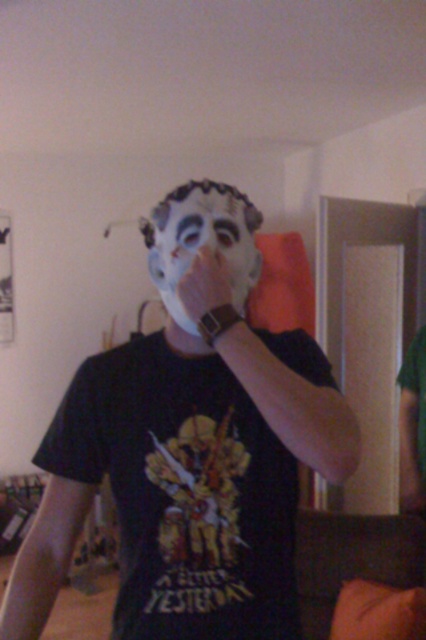
Consider the image. Does matte white mask at center have a greater height compared to white matte mask at center?

Yes.

Is matte white mask at center bigger than white matte mask at center?

Indeed, matte white mask at center has a larger size compared to white matte mask at center.

Is point (43, 595) positioned after point (244, 280)?

No, (43, 595) is closer to viewer.

Find the location of `matte white mask at center`. matte white mask at center is located at coordinates (190, 445).